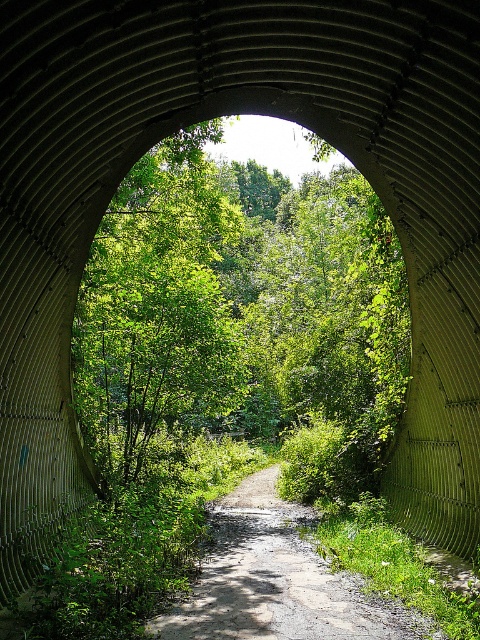
Which is below, green leafy tree at center or dirt/gravel path at center?

dirt/gravel path at center

Does point (358, 192) come farther from viewer compared to point (182, 604)?

Yes.

The width and height of the screenshot is (480, 640). Identify the location of green leafy tree at center. (240, 312).